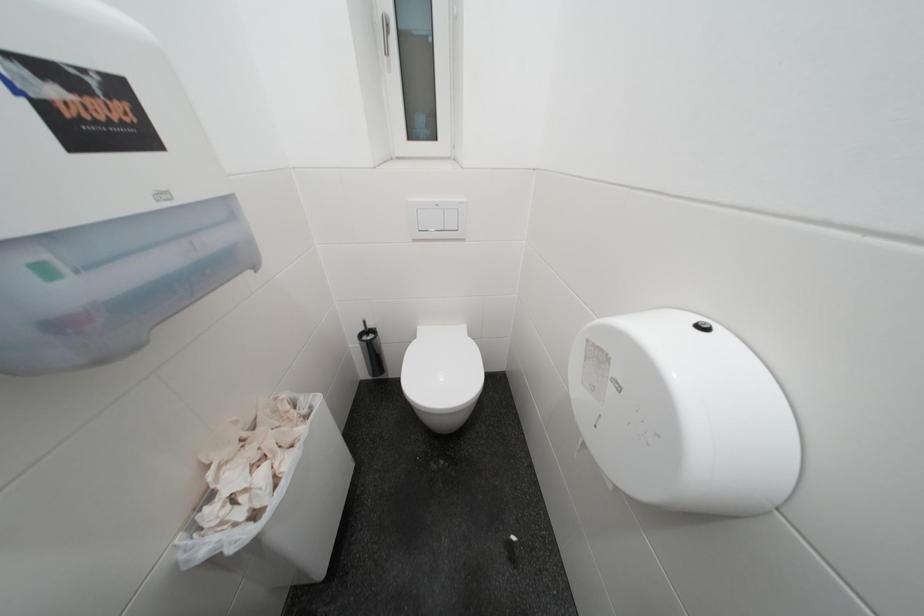
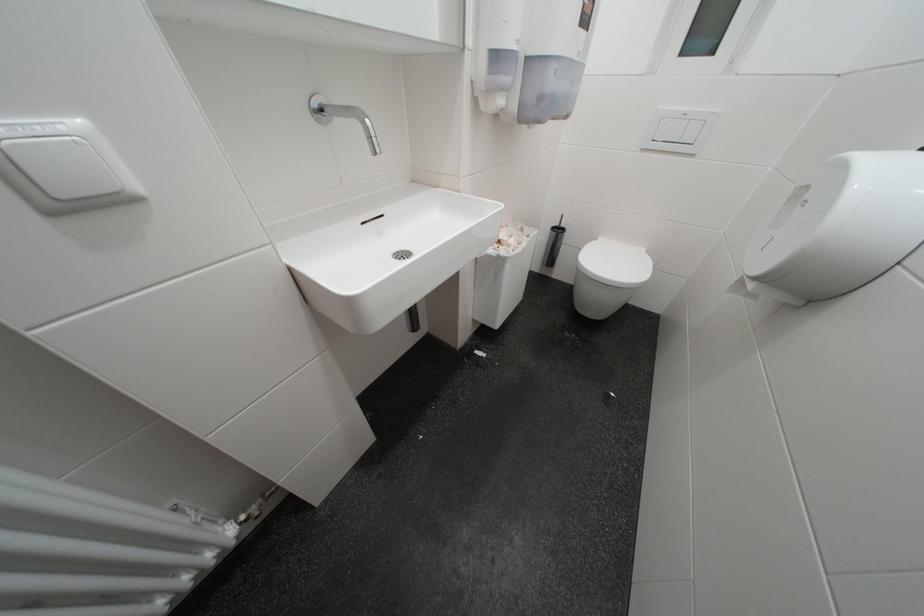
Question: How did the camera likely rotate?

Choices:
 (A) Left
 (B) Right
 (C) Up
 (D) Down

Answer: (A)